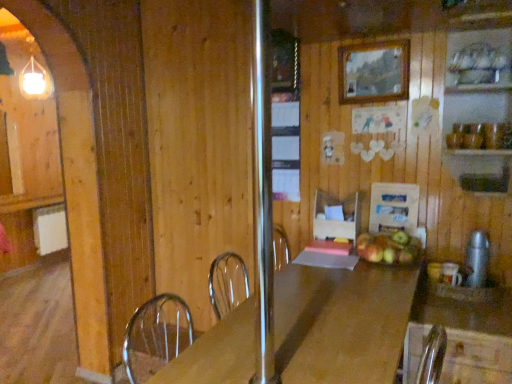
Question: Should I look upward or downward to see satin silver thermos at right, positioned as the second appliance in back-to-front order?

Choices:
 (A) down
 (B) up

Answer: (A)

Question: Could you tell me if wooden picture frame at upper center is turned towards wooden countertop at right?

Choices:
 (A) no
 (B) yes

Answer: (A)

Question: Considering the relative sizes of wooden picture frame at upper center and wooden countertop at right in the image provided, is wooden picture frame at upper center wider than wooden countertop at right?

Choices:
 (A) no
 (B) yes

Answer: (A)

Question: Is wooden picture frame at upper center shorter than wooden countertop at right?

Choices:
 (A) no
 (B) yes

Answer: (B)

Question: From the image's perspective, would you say wooden picture frame at upper center is shown under wooden countertop at right?

Choices:
 (A) yes
 (B) no

Answer: (B)

Question: Can you confirm if wooden picture frame at upper center is taller than wooden countertop at right?

Choices:
 (A) no
 (B) yes

Answer: (A)

Question: Considering the relative positions of wooden picture frame at upper center and wooden countertop at right in the image provided, is wooden picture frame at upper center to the right of wooden countertop at right from the viewer's perspective?

Choices:
 (A) no
 (B) yes

Answer: (A)

Question: Does wooden cutting board at center, which ranks as the 2th appliance in front-to-back order, turn towards wooden picture frame at upper center?

Choices:
 (A) yes
 (B) no

Answer: (B)

Question: Considering the relative positions of wooden cutting board at center, arranged as the 1th appliance when viewed from the back, and wooden picture frame at upper center in the image provided, is wooden cutting board at center, arranged as the 1th appliance when viewed from the back, behind wooden picture frame at upper center?

Choices:
 (A) yes
 (B) no

Answer: (A)

Question: Can you confirm if wooden cutting board at center, marked as the 2th appliance in a right-to-left arrangement, is shorter than wooden picture frame at upper center?

Choices:
 (A) yes
 (B) no

Answer: (B)

Question: Considering the relative sizes of wooden cutting board at center, marked as the 2th appliance in a right-to-left arrangement, and wooden picture frame at upper center in the image provided, is wooden cutting board at center, marked as the 2th appliance in a right-to-left arrangement, taller than wooden picture frame at upper center?

Choices:
 (A) no
 (B) yes

Answer: (B)

Question: From the image's perspective, is wooden cutting board at center, which ranks as the 2th appliance in front-to-back order, over wooden picture frame at upper center?

Choices:
 (A) yes
 (B) no

Answer: (B)

Question: Can you confirm if wooden cutting board at center, which is counted as the 1th appliance, starting from the left, is thinner than wooden picture frame at upper center?

Choices:
 (A) no
 (B) yes

Answer: (A)